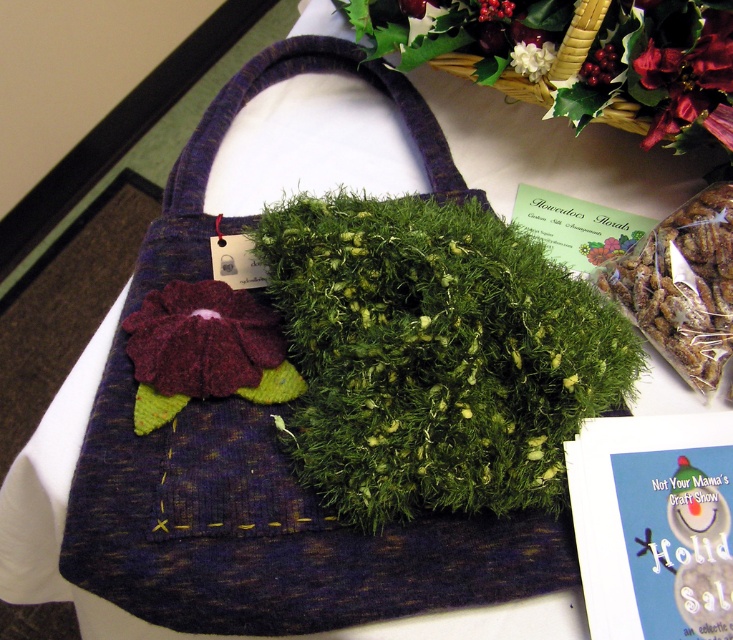
Which of these two, white fluffy flower at upper center or velvety purple flower at center, stands taller?

velvety purple flower at center

Is white fluffy flower at upper center below velvety purple flower at center?

Incorrect, white fluffy flower at upper center is not positioned below velvety purple flower at center.

This screenshot has height=640, width=733. What do you see at coordinates (531, 58) in the screenshot?
I see `white fluffy flower at upper center` at bounding box center [531, 58].

Locate an element on the screen. The width and height of the screenshot is (733, 640). white fluffy flower at upper center is located at coordinates (531, 58).

Can you confirm if shiny red flower at upper right is shorter than green mossy flower at upper center?

No.

Between point (703, 76) and point (611, 49), which one is positioned in front?

Point (703, 76)

The image size is (733, 640). In order to click on shiny red flower at upper right in this screenshot , I will do `click(690, 80)`.

Is white fluffy flower at upper center positioned in front of green fuzzy flower at upper center?

That is False.

Is point (517, 45) behind point (500, 19)?

Yes, it is behind point (500, 19).

I want to click on white fluffy flower at upper center, so click(531, 58).